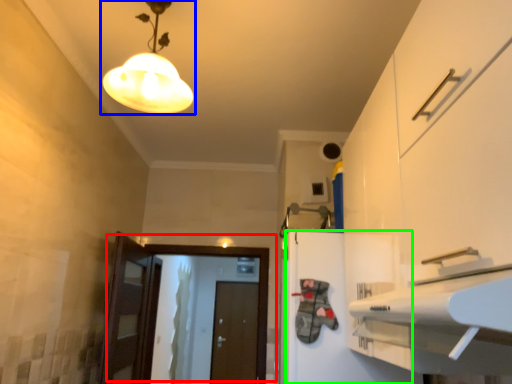
Question: Considering the real-world distances, which object is farthest from door (highlighted by a red box)? lamp (highlighted by a blue box) or cabinetry (highlighted by a green box)?

Choices:
 (A) lamp
 (B) cabinetry

Answer: (A)